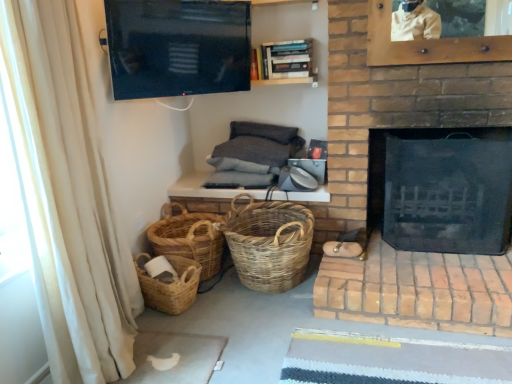
This screenshot has height=384, width=512. What are the coordinates of `free point above reddish-brown brick at right (from a real-world perspective)` in the screenshot? It's located at (423, 263).